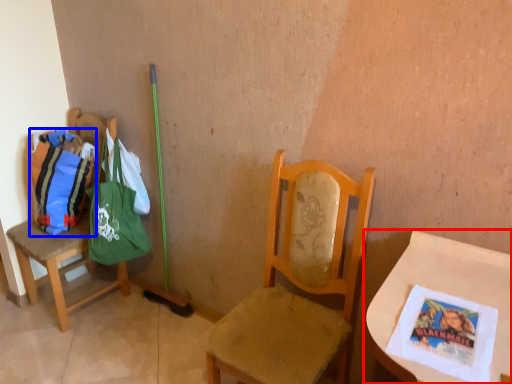
Question: Which of the following is the closest to the observer, table (highlighted by a red box) or grocery bag (highlighted by a blue box)?

Choices:
 (A) table
 (B) grocery bag

Answer: (A)